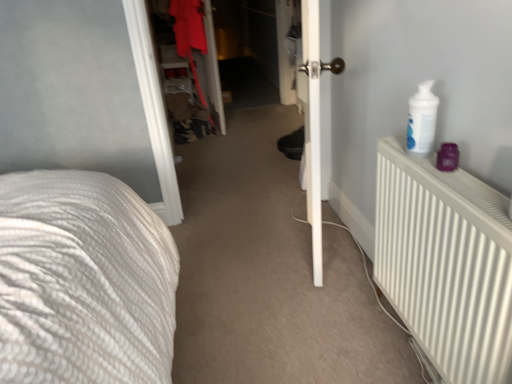
Question: Is white smooth door at center positioned beyond the bounds of matte red coat at center?

Choices:
 (A) yes
 (B) no

Answer: (A)

Question: Can you confirm if white smooth door at center is shorter than matte red coat at center?

Choices:
 (A) no
 (B) yes

Answer: (A)

Question: Considering the relative sizes of white smooth door at center and matte red coat at center in the image provided, is white smooth door at center taller than matte red coat at center?

Choices:
 (A) no
 (B) yes

Answer: (B)

Question: Is white smooth door at center oriented away from matte red coat at center?

Choices:
 (A) no
 (B) yes

Answer: (A)

Question: Is matte red coat at center a part of white smooth door at center?

Choices:
 (A) yes
 (B) no

Answer: (B)

Question: In terms of size, does matte red coat at center appear bigger or smaller than white smooth door at center?

Choices:
 (A) small
 (B) big

Answer: (B)

Question: Is matte red coat at center wider or thinner than white smooth door at center?

Choices:
 (A) thin
 (B) wide

Answer: (B)

Question: Is matte red coat at center taller or shorter than white smooth door at center?

Choices:
 (A) short
 (B) tall

Answer: (A)

Question: In the image, is matte red coat at center positioned in front of or behind white smooth door at center?

Choices:
 (A) front
 (B) behind

Answer: (B)

Question: From the image's perspective, is white matte radiator at right above or below matte red coat at center?

Choices:
 (A) below
 (B) above

Answer: (A)

Question: Does point (377, 205) appear closer or farther from the camera than point (181, 39)?

Choices:
 (A) farther
 (B) closer

Answer: (B)

Question: In terms of size, does white matte radiator at right appear bigger or smaller than matte red coat at center?

Choices:
 (A) big
 (B) small

Answer: (B)

Question: Is white matte radiator at right inside the boundaries of matte red coat at center, or outside?

Choices:
 (A) inside
 (B) outside

Answer: (B)

Question: In terms of height, does white smooth door at center look taller or shorter compared to white matte radiator at right?

Choices:
 (A) tall
 (B) short

Answer: (A)

Question: Is white smooth door at center in front of or behind white matte radiator at right in the image?

Choices:
 (A) front
 (B) behind

Answer: (B)